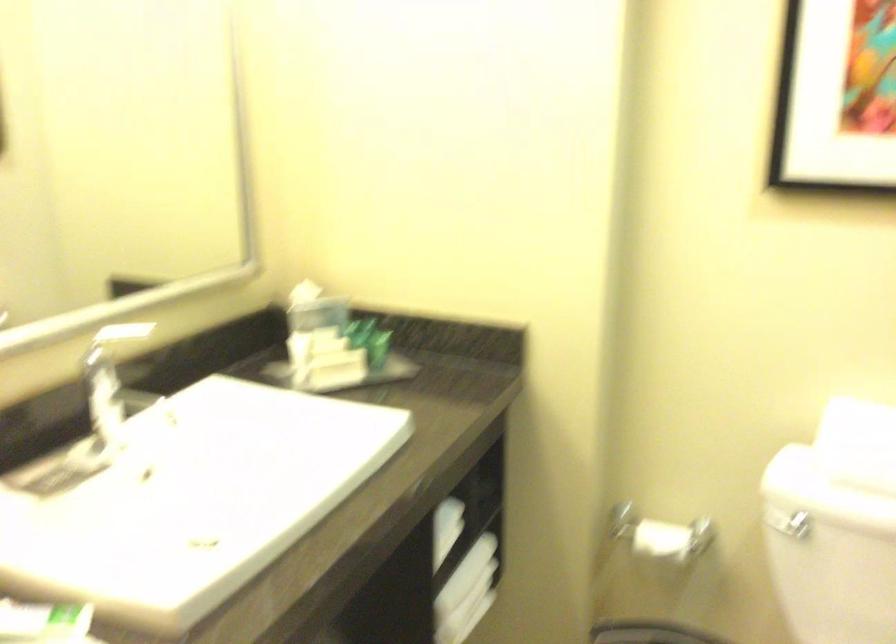
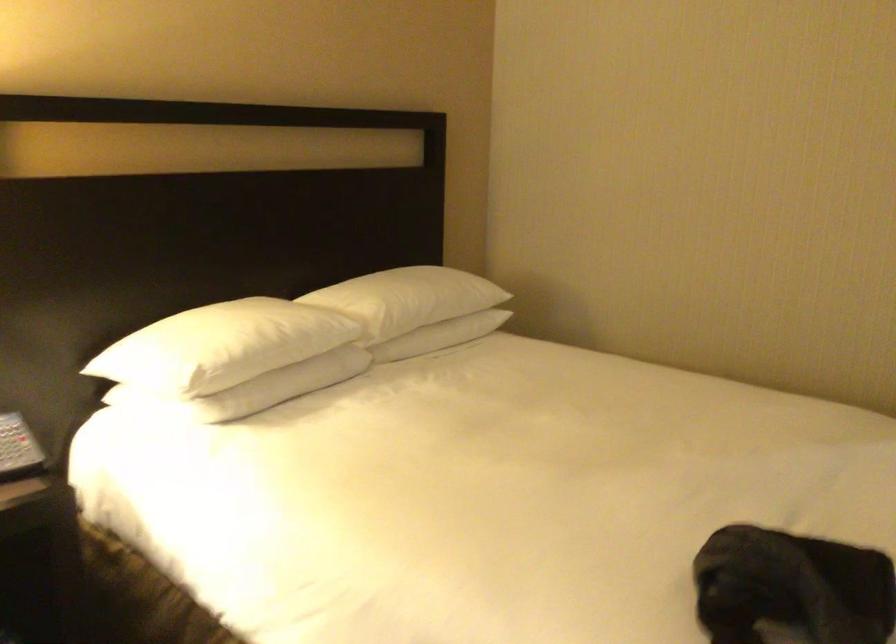
Question: I am providing you with two images of the same scene from different viewpoints. Please identify which objects are invisible in image2.

Choices:
 (A) telephone handset
 (B) telephone button
 (C) toilet flush handle
 (D) door key

Answer: (C)